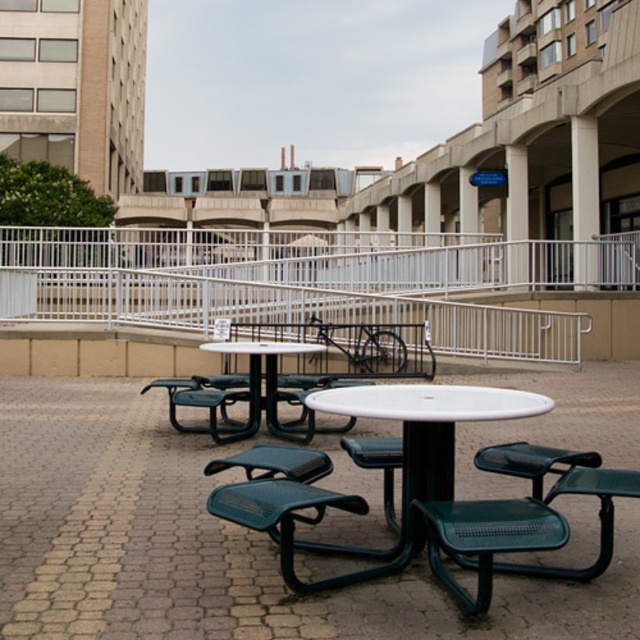
Question: Can you confirm if white metal rail at upper center is positioned to the right of white plastic table at center?

Choices:
 (A) no
 (B) yes

Answer: (A)

Question: Is white metal rail at upper center smaller than white concrete pillar at center?

Choices:
 (A) yes
 (B) no

Answer: (B)

Question: Does green plastic chair at center appear on the left side of green plastic table at center?

Choices:
 (A) yes
 (B) no

Answer: (A)

Question: Which object is the farthest from the white plastic table at center?

Choices:
 (A) green plastic table at center
 (B) white metal rail at upper center
 (C) white concrete pillar at upper center
 (D) green plastic chair at center

Answer: (C)

Question: Which point appears closest to the camera in this image?

Choices:
 (A) (470, 400)
 (B) (506, 198)
 (C) (211, 404)

Answer: (A)

Question: Which point is closer to the camera taking this photo?

Choices:
 (A) (515, 218)
 (B) (209, 392)
 (C) (467, 387)
 (D) (349, 298)

Answer: (C)